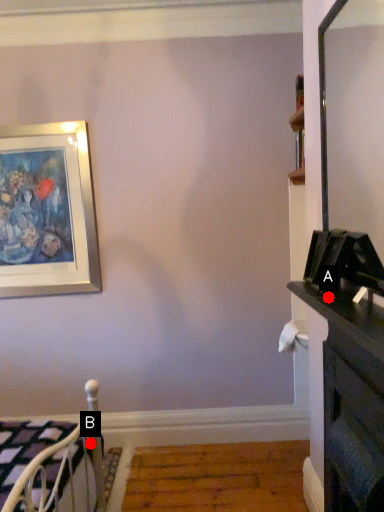
Question: Two points are circled on the image, labeled by A and B beside each circle. Which point is further to the camera?

Choices:
 (A) A is further
 (B) B is further

Answer: (B)